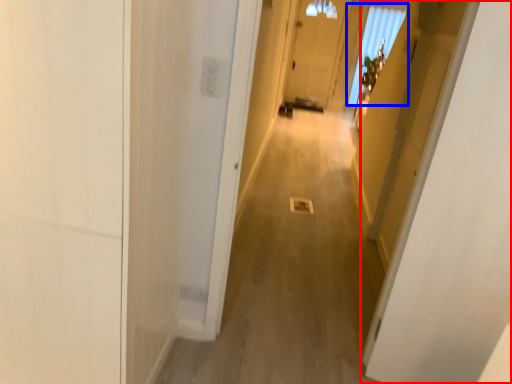
Question: Which of the following is the farthest to the observer, door (highlighted by a red box) or window (highlighted by a blue box)?

Choices:
 (A) door
 (B) window

Answer: (B)